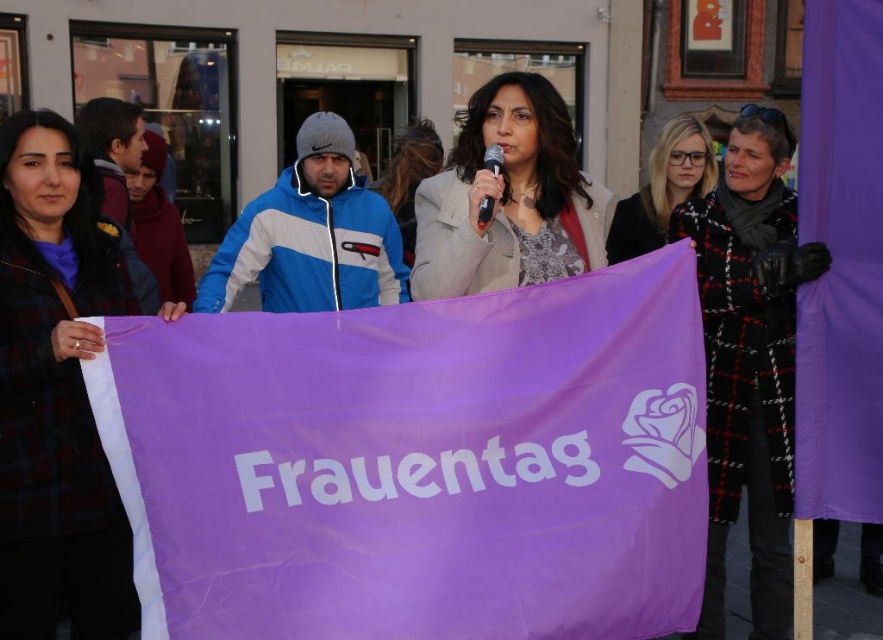
Who is shorter, matte gray blazer at center or blonde hair at center?

matte gray blazer at center is shorter.

Is matte gray blazer at center to the left of blonde hair at center from the viewer's perspective?

Correct, you'll find matte gray blazer at center to the left of blonde hair at center.

Which is in front, point (546, 243) or point (639, 218)?

Point (546, 243)

At what (x,y) coordinates should I click in order to perform the action: click on matte gray blazer at center. Please return your answer as a coordinate pair (x, y). The image size is (883, 640). Looking at the image, I should click on pyautogui.click(x=508, y=196).

Between point (353, 632) and point (691, 173), which one is positioned behind?

The point (691, 173) is behind.

Is point (678, 576) more distant than point (662, 208)?

No, it is not.

What are the coordinates of `purple fabric banner at center` in the screenshot? It's located at (417, 464).

Based on the photo, does blonde hair at center have a smaller size compared to black plastic microphone at center?

Incorrect, blonde hair at center is not smaller in size than black plastic microphone at center.

Is blonde hair at center further to the viewer compared to black plastic microphone at center?

Yes, it is behind black plastic microphone at center.

Who is more distant from viewer, (660, 156) or (485, 196)?

The point (660, 156) is more distant.

You are a GUI agent. You are given a task and a screenshot of the screen. Output one action in this format:
    pyautogui.click(x=<x>, y=<y>)
    Task: Click on the blonde hair at center
    
    Given the screenshot: What is the action you would take?
    pyautogui.click(x=663, y=188)